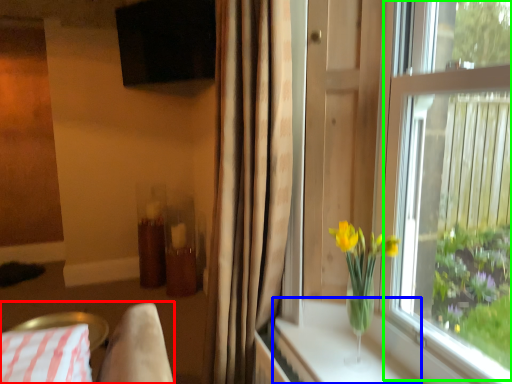
Question: Estimate the real-world distances between objects in this image. Which object is closer to bedding (highlighted by a red box), window sill (highlighted by a blue box) or window screen (highlighted by a green box)?

Choices:
 (A) window sill
 (B) window screen

Answer: (A)